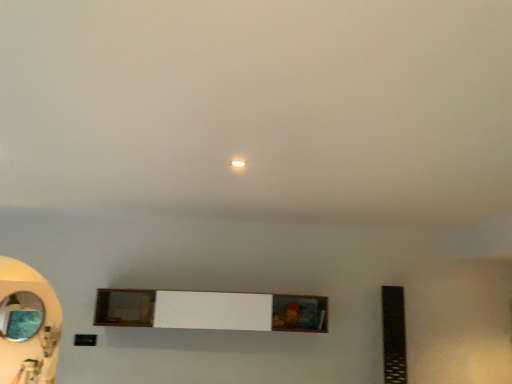
Question: From the image's perspective, is white wood shelf at center positioned above or below oval glass mirror at left?

Choices:
 (A) below
 (B) above

Answer: (B)

Question: Is white wood shelf at center wider or thinner than oval glass mirror at left?

Choices:
 (A) wide
 (B) thin

Answer: (A)

Question: From a real-world perspective, is white wood shelf at center above or below oval glass mirror at left?

Choices:
 (A) above
 (B) below

Answer: (A)

Question: From a real-world perspective, is oval glass mirror at left above or below white wood shelf at center?

Choices:
 (A) above
 (B) below

Answer: (B)

Question: Is point (25, 322) closer or farther from the camera than point (239, 314)?

Choices:
 (A) farther
 (B) closer

Answer: (B)

Question: Considering the relative positions of oval glass mirror at left and white wood shelf at center in the image provided, is oval glass mirror at left to the left or to the right of white wood shelf at center?

Choices:
 (A) left
 (B) right

Answer: (A)

Question: Relative to white wood shelf at center, is oval glass mirror at left in front or behind?

Choices:
 (A) front
 (B) behind

Answer: (B)